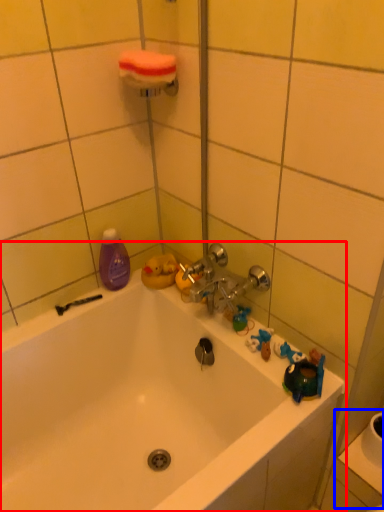
Question: Which object appears farthest to the camera in this image, bathtub (highlighted by a red box) or sink (highlighted by a blue box)?

Choices:
 (A) bathtub
 (B) sink

Answer: (B)